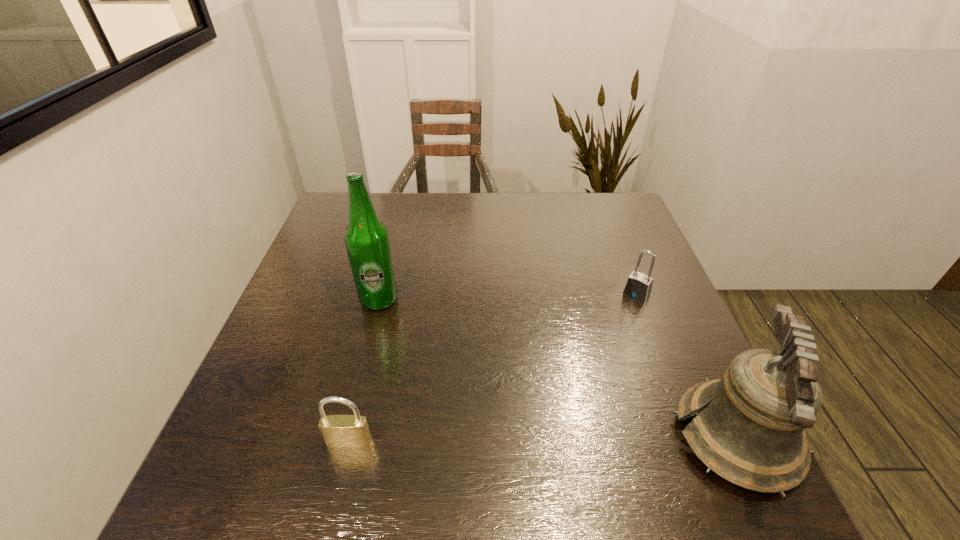
Identify the location of the nearer padlock. (344, 431).

This screenshot has height=540, width=960. I want to click on the second tallest object, so click(750, 429).

Identify the location of the farther padlock. The height and width of the screenshot is (540, 960). (638, 286).

Where is `the tallest object`? The width and height of the screenshot is (960, 540). the tallest object is located at coordinates (366, 238).

Where is `free spot located on the back of the bell`? free spot located on the back of the bell is located at coordinates (656, 267).

Where is `free spot located on the shackle of the right padlock`? free spot located on the shackle of the right padlock is located at coordinates (605, 338).

Find the location of a particular element. The height and width of the screenshot is (540, 960). blank space located 0.090m on the shackle of the right padlock is located at coordinates (615, 322).

Locate an element on the screen. Image resolution: width=960 pixels, height=540 pixels. vacant space situated 0.360m on the shackle of the right padlock is located at coordinates (559, 402).

Locate an element on the screen. The image size is (960, 540). free space located on the label of the beer bottle is located at coordinates (468, 374).

Find the location of a particular element. This screenshot has height=540, width=960. free space located 0.290m on the label of the beer bottle is located at coordinates (474, 380).